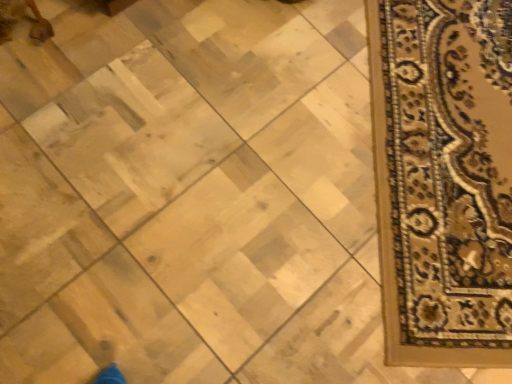
You are a GUI agent. You are given a task and a screenshot of the screen. Output one action in this format:
    pyautogui.click(x=<x>, y=<y>)
    Task: Click on the vacant area to the left of carpet with intricate patterns at right
    The width and height of the screenshot is (512, 384).
    Given the screenshot: What is the action you would take?
    pyautogui.click(x=228, y=120)